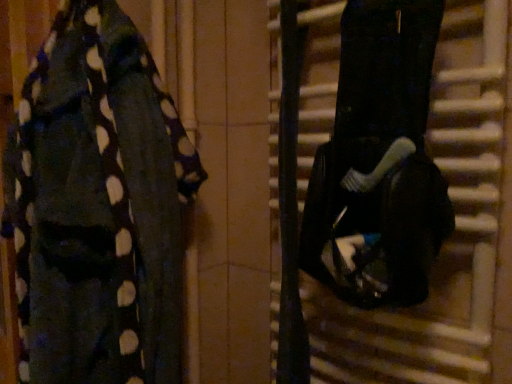
Question: Considering the relative sizes of black matte guitar case at right and polka dot fabric at left in the image provided, is black matte guitar case at right bigger than polka dot fabric at left?

Choices:
 (A) yes
 (B) no

Answer: (B)

Question: From a real-world perspective, is black matte guitar case at right located beneath polka dot fabric at left?

Choices:
 (A) no
 (B) yes

Answer: (A)

Question: Is polka dot fabric at left inside black matte guitar case at right?

Choices:
 (A) yes
 (B) no

Answer: (B)

Question: From the image's perspective, would you say black matte guitar case at right is positioned over polka dot fabric at left?

Choices:
 (A) no
 (B) yes

Answer: (B)

Question: Considering the relative sizes of black matte guitar case at right and polka dot fabric at left in the image provided, is black matte guitar case at right taller than polka dot fabric at left?

Choices:
 (A) yes
 (B) no

Answer: (B)

Question: Considering the relative sizes of black matte guitar case at right and polka dot fabric at left in the image provided, is black matte guitar case at right thinner than polka dot fabric at left?

Choices:
 (A) no
 (B) yes

Answer: (B)

Question: Can you confirm if polka dot fabric at left is shorter than black matte guitar case at right?

Choices:
 (A) yes
 (B) no

Answer: (B)

Question: Is polka dot fabric at left far away from black matte guitar case at right?

Choices:
 (A) no
 (B) yes

Answer: (A)

Question: Considering the relative sizes of polka dot fabric at left and black matte guitar case at right in the image provided, is polka dot fabric at left bigger than black matte guitar case at right?

Choices:
 (A) yes
 (B) no

Answer: (A)

Question: Does polka dot fabric at left have a greater width compared to black matte guitar case at right?

Choices:
 (A) no
 (B) yes

Answer: (B)

Question: Is polka dot fabric at left outside of black matte guitar case at right?

Choices:
 (A) yes
 (B) no

Answer: (A)

Question: From a real-world perspective, is polka dot fabric at left physically above black matte guitar case at right?

Choices:
 (A) yes
 (B) no

Answer: (B)

Question: Does point (61, 317) appear closer or farther from the camera than point (358, 168)?

Choices:
 (A) closer
 (B) farther

Answer: (A)